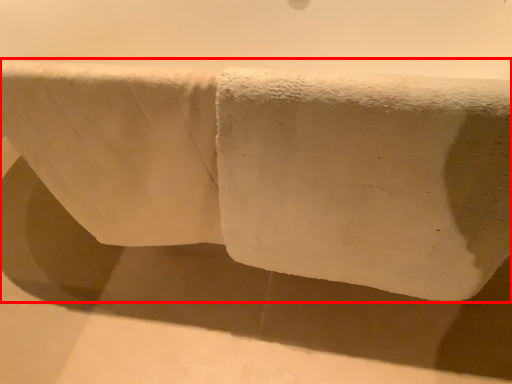
Question: From the image, what is the correct spatial relationship of towel (annotated by the red box) in relation to bath towel?

Choices:
 (A) left
 (B) right

Answer: (B)